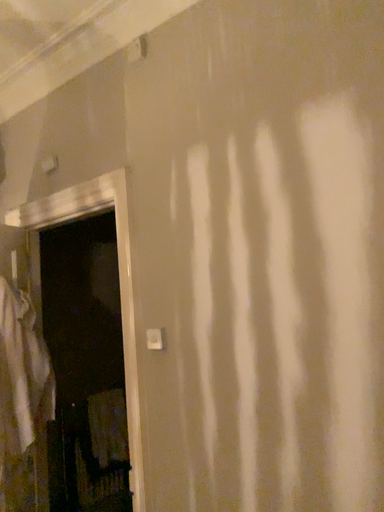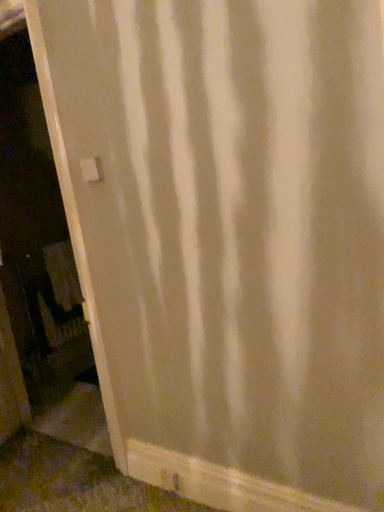
Question: How did the camera likely rotate when shooting the video?

Choices:
 (A) rotated downward
 (B) rotated upward

Answer: (A)